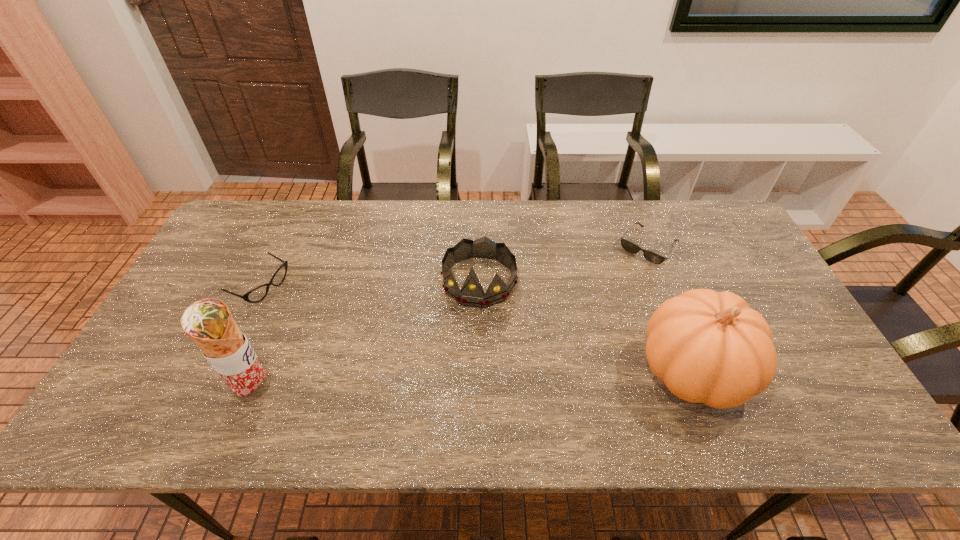
At what (x,y) coordinates should I click in order to perform the action: click on blank area in the image that satisfies the following two spatial constraints: 1. on the back side of the shortest object; 2. on the right side of the burrito. Please return your answer as a coordinate pair (x, y). The image size is (960, 540). Looking at the image, I should click on (311, 247).

At what (x,y) coordinates should I click in order to perform the action: click on free space in the image that satisfies the following two spatial constraints: 1. on the back side of the tiara; 2. on the right side of the fourth tallest object. Please return your answer as a coordinate pair (x, y). The height and width of the screenshot is (540, 960). Looking at the image, I should click on (264, 281).

Locate an element on the screen. The height and width of the screenshot is (540, 960). vacant space that satisfies the following two spatial constraints: 1. on the front side of the third tallest object; 2. on the right side of the pumpkin is located at coordinates (479, 370).

The width and height of the screenshot is (960, 540). I want to click on free spot that satisfies the following two spatial constraints: 1. on the back side of the burrito; 2. on the left side of the shortest object, so click(311, 247).